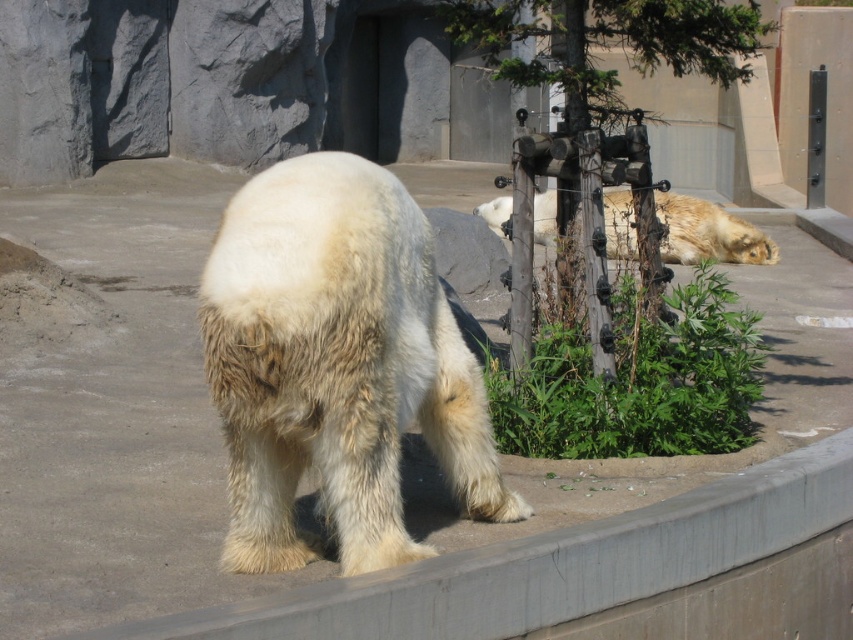
Is gray concrete ledge at lower center bigger than fuzzy golden bear at center?

Yes.

Does point (813, 611) come farther from viewer compared to point (672, 212)?

No, (813, 611) is closer to viewer.

At what (x,y) coordinates should I click in order to perform the action: click on gray concrete ledge at lower center. Please return your answer as a coordinate pair (x, y). Looking at the image, I should click on (598, 573).

How much distance is there between white fluffy bear at center and fuzzy golden bear at center?

white fluffy bear at center and fuzzy golden bear at center are 8.33 feet apart.

Can you confirm if white fluffy bear at center is positioned below fuzzy golden bear at center?

Indeed, white fluffy bear at center is positioned under fuzzy golden bear at center.

Is point (221, 408) farther from camera compared to point (720, 250)?

No, it is not.

This screenshot has width=853, height=640. I want to click on white fluffy bear at center, so click(x=335, y=365).

Who is positioned more to the left, white fluffy bear at center or gray concrete ledge at lower center?

Positioned to the left is white fluffy bear at center.

Does white fluffy bear at center have a lesser width compared to gray concrete ledge at lower center?

Yes, white fluffy bear at center is thinner than gray concrete ledge at lower center.

Is point (210, 371) more distant than point (497, 582)?

Yes, it is.

Image resolution: width=853 pixels, height=640 pixels. Identify the location of white fluffy bear at center. (335, 365).